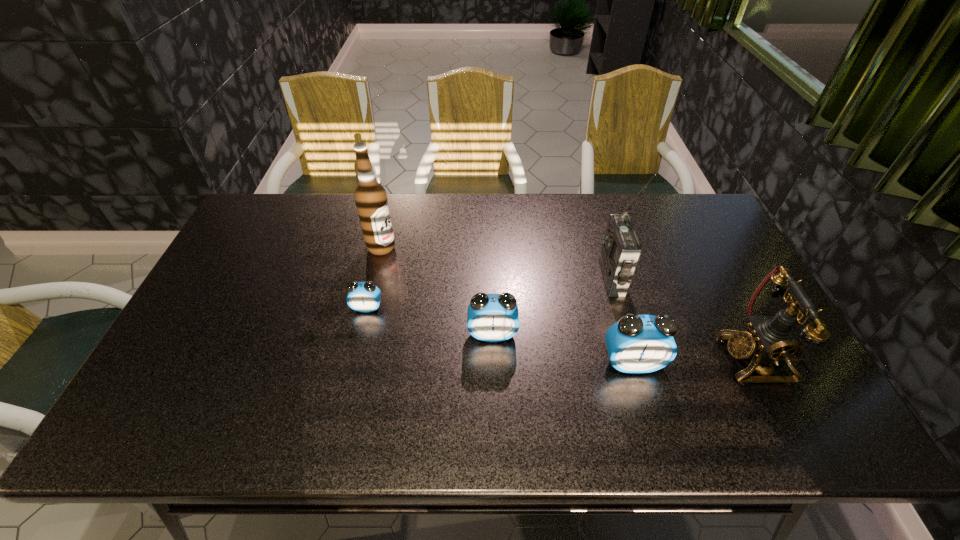
Identify the location of vacant area located 0.100m on the face of the second tallest alarm clock. The image size is (960, 540). (493, 377).

This screenshot has height=540, width=960. Identify the location of free space located 0.290m on the front of the telephone, featuring the rotary dial. (607, 358).

The image size is (960, 540). I want to click on free space located 0.080m on the front of the telephone, featuring the rotary dial, so click(x=689, y=358).

I want to click on blank space located on the front of the telephone, featuring the rotary dial, so click(607, 358).

Where is `vacant space situated 0.330m on the label of the farthest object`? This screenshot has width=960, height=540. vacant space situated 0.330m on the label of the farthest object is located at coordinates (499, 247).

Where is `vacant space located on the display of the radio receiver`? vacant space located on the display of the radio receiver is located at coordinates (562, 278).

The width and height of the screenshot is (960, 540). I want to click on free space located on the display of the radio receiver, so click(x=501, y=278).

The width and height of the screenshot is (960, 540). I want to click on vacant space situated on the display of the radio receiver, so click(528, 278).

You are a GUI agent. You are given a task and a screenshot of the screen. Output one action in this format:
    pyautogui.click(x=<x>, y=<y>)
    Task: Click on the alarm clock at the near edge
    This screenshot has height=540, width=960.
    Given the screenshot: What is the action you would take?
    pyautogui.click(x=637, y=344)

Where is `telephone at the near edge`? This screenshot has height=540, width=960. telephone at the near edge is located at coordinates point(769,338).